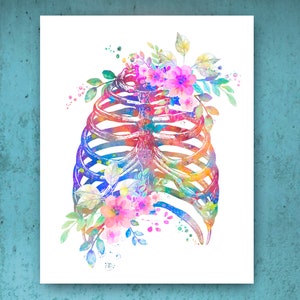
At what (x,y) coordinates should I click in order to perform the action: click on blue wall under art. Please return your answer as a coordinate pair (x, y). This screenshot has height=300, width=300. Looking at the image, I should click on (141, 292).